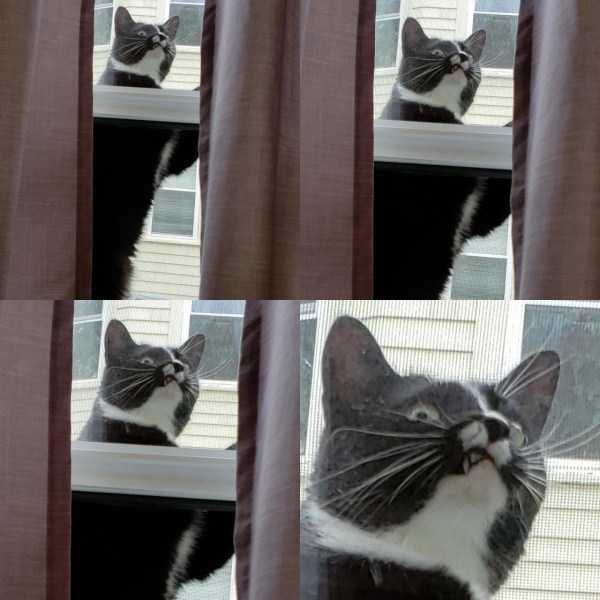
This screenshot has width=600, height=600. Find the location of `windows`. windows is located at coordinates (181, 15), (103, 17), (501, 29), (387, 32), (566, 340), (306, 342), (195, 337), (73, 340).